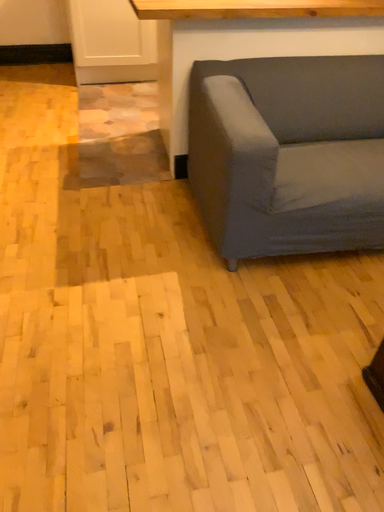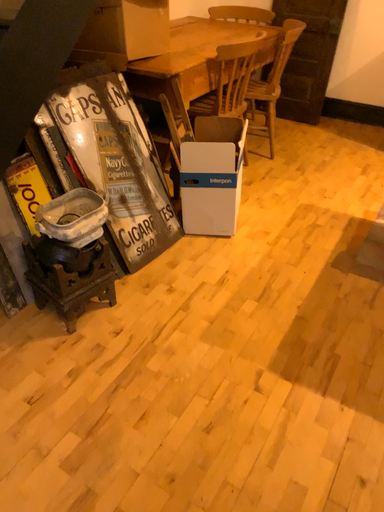
Question: Which way did the camera rotate in the video?

Choices:
 (A) rotated left
 (B) rotated right

Answer: (A)